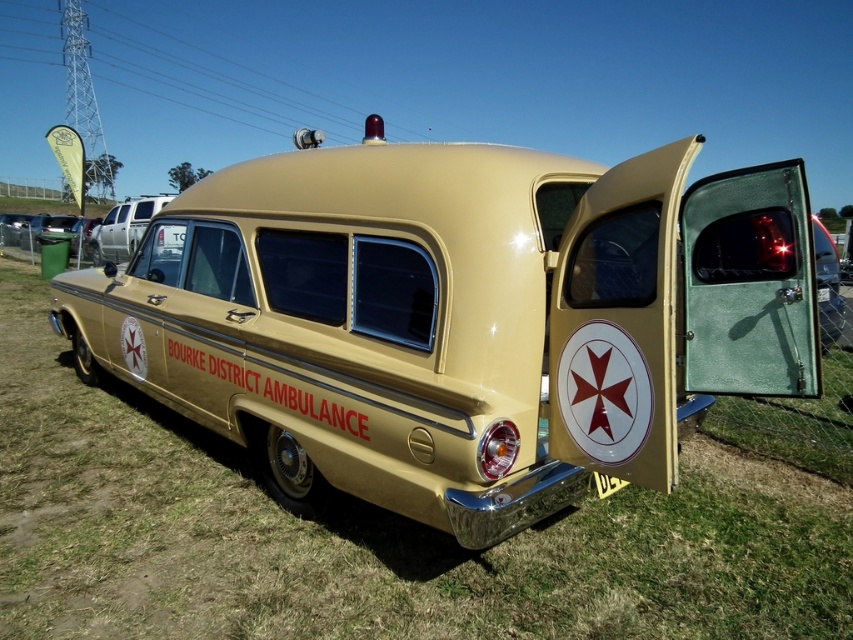
You are standing in front of the vintage ambulance and notice two points marked on its side. The first point is at coordinates point (439, 474) and the second point is at point (821, 291). From your perspective, which point is closer to you?

Point (439, 474) is in front of point (821, 291), so it is closer to you.